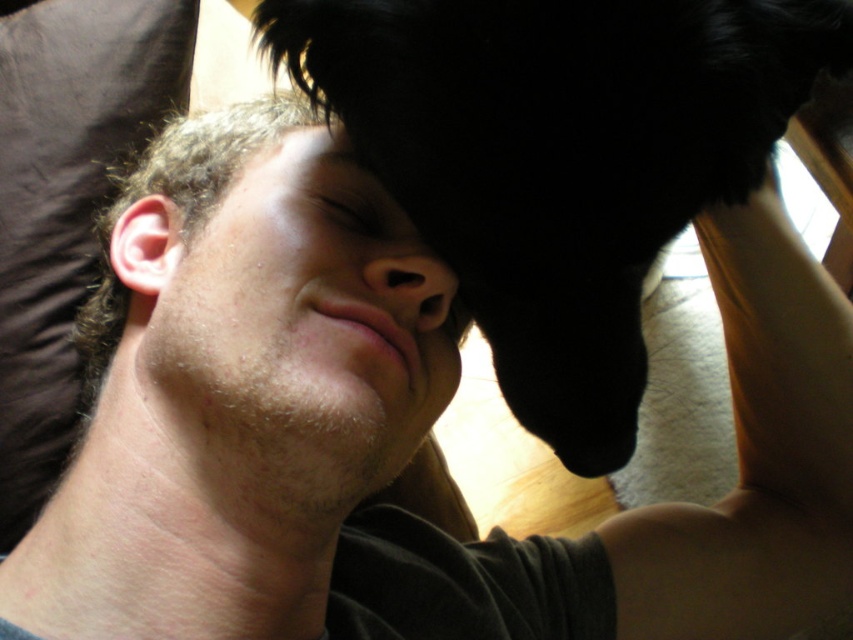
You are a photographer trying to capture a close shot of the black fur at upper center and the smooth skin head at center. Which object is positioned nearer to the camera lens?

The black fur at upper center is closer to the viewer than the smooth skin head at center, so it is nearer to the camera lens.

You are a photographer trying to capture a close shot of the black fur at upper center and the smooth skin head at center. The camera requires a minimum distance of 6 inches between subjects to focus properly. Based on the scene, will the camera be able to focus on both subjects clearly?

The black fur at upper center is only 5.42 inches away from the smooth skin head at center, which is less than the required 6 inches. Therefore, the camera may struggle to focus on both subjects clearly due to the insufficient distance between them.

You are a photographer standing in the room. You want to take a portrait of the smooth skin head at center. Your camera has a minimum focusing distance of 20 inches. Can you take the photo without moving closer than the minimum distance?

The smooth skin head at center and viewer are 18.78 inches apart. Since the minimum focusing distance is 20 inches, you need to move back to at least 20 inches away to take the photo. Therefore, you cannot take the photo without moving closer than the minimum distance because you are already closer than required.